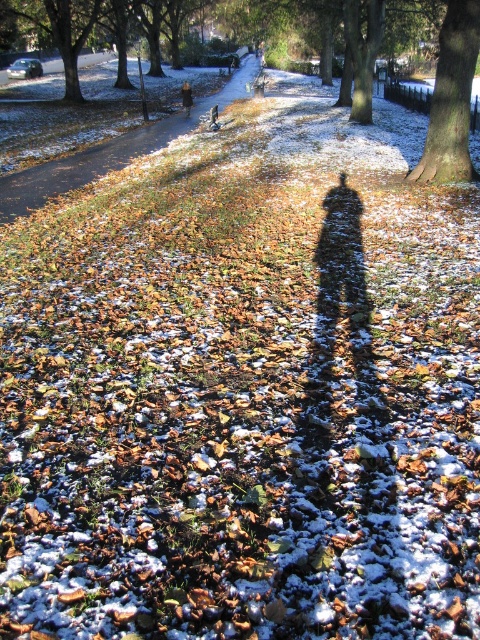
Is brown leafy path at center further to the viewer compared to brown rough textured tree at center right?

Yes, it is.

From the picture: Between brown leafy path at center and brown rough textured tree at center right, which one is positioned higher?

Positioned higher is brown leafy path at center.

Between point (124, 147) and point (455, 177), which one is positioned in front?

Positioned in front is point (455, 177).

Where is `brown leafy path at center`? brown leafy path at center is located at coordinates (109, 150).